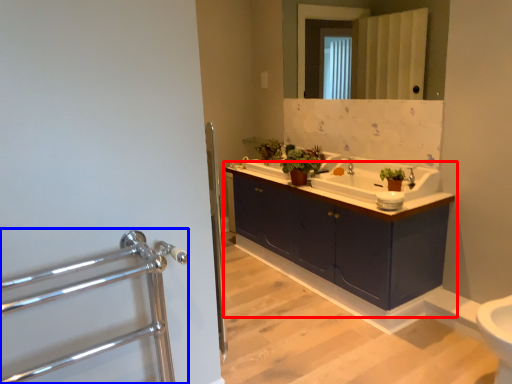
Question: Which object is further to the camera taking this photo, bathroom cabinet (highlighted by a red box) or steel (highlighted by a blue box)?

Choices:
 (A) bathroom cabinet
 (B) steel

Answer: (A)